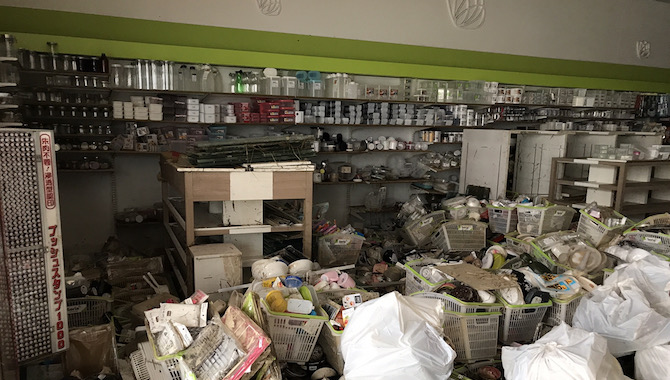
Identify the location of wall. (331, 21).